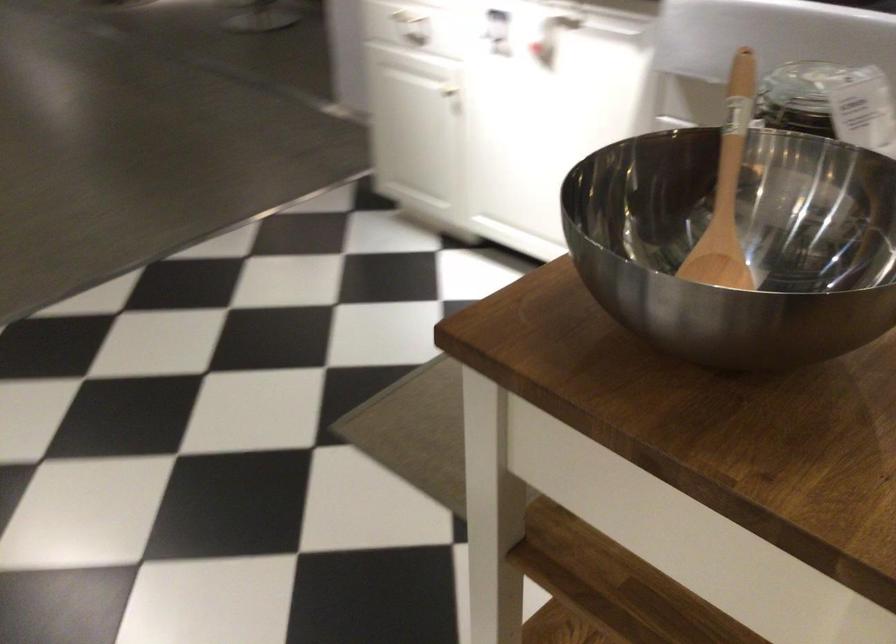
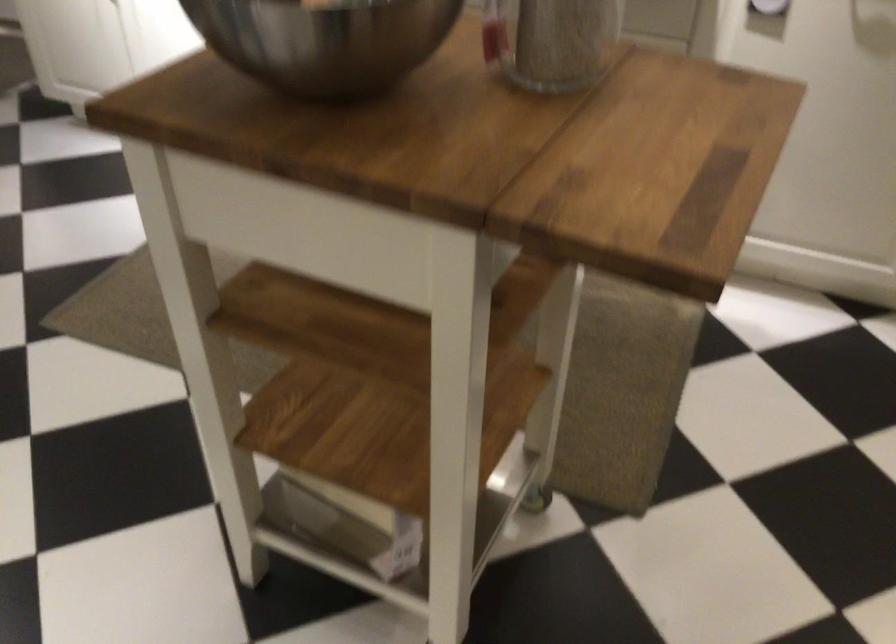
Question: In a continuous first-person perspective shot, in which direction is the camera moving?

Choices:
 (A) Left
 (B) Right
 (C) Forward
 (D) Backward

Answer: (D)